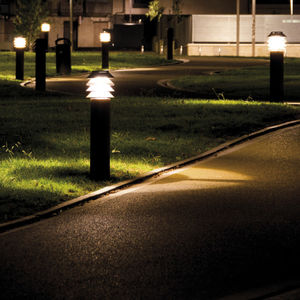
Locate an element on the screen. lights is located at coordinates (104, 85), (273, 41), (45, 29), (22, 43), (105, 33).